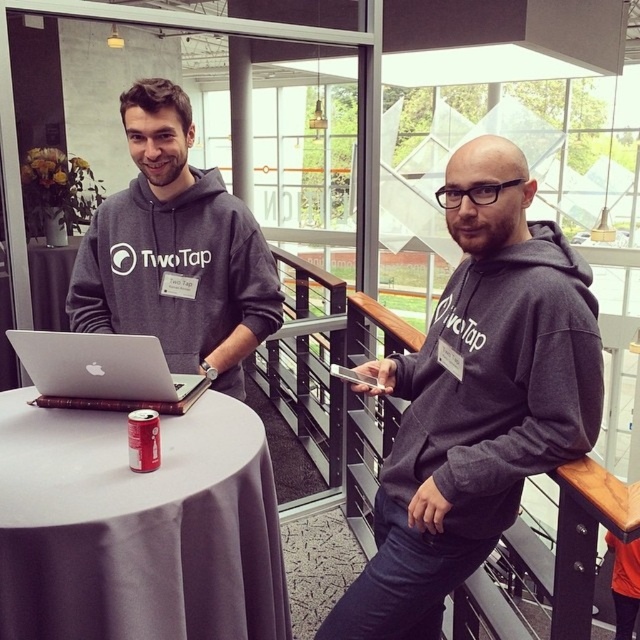
The image size is (640, 640). Describe the element at coordinates (476, 400) in the screenshot. I see `dark gray hoodie at center` at that location.

Is point (532, 417) positioned in front of point (128, 417)?

Yes, it is in front of point (128, 417).

Locate an element on the screen. This screenshot has width=640, height=640. dark gray hoodie at center is located at coordinates (476, 400).

Which is more to the right, white satin round table at center or matte gray hoodie at center?

white satin round table at center

Can you confirm if white satin round table at center is positioned to the left of matte gray hoodie at center?

In fact, white satin round table at center is to the right of matte gray hoodie at center.

Does point (16, 419) come in front of point (70, 314)?

Yes, it is.

Where is `white satin round table at center`? Image resolution: width=640 pixels, height=640 pixels. white satin round table at center is located at coordinates (138, 528).

Does dark gray hoodie at center come behind white satin round table at center?

That is True.

Locate an element on the screen. This screenshot has width=640, height=640. dark gray hoodie at center is located at coordinates (476, 400).